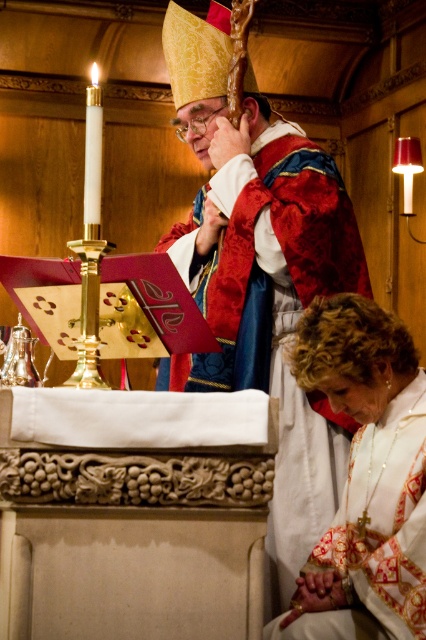
You are attending the religious ceremony and want to know which point is closer to you. The points are point (x=321, y=440) and point (x=423, y=480). Which one is closer?

Point (x=321, y=440) is further to the camera than point (x=423, y=480), so the point closer to you is point (x=423, y=480).

You are an attendee at this religious ceremony. You see the velvet red robe at center and the white embroidered robe at lower right. Which robe is located to the left of the other?

The velvet red robe at center is positioned on the left side of white embroidered robe at lower right.